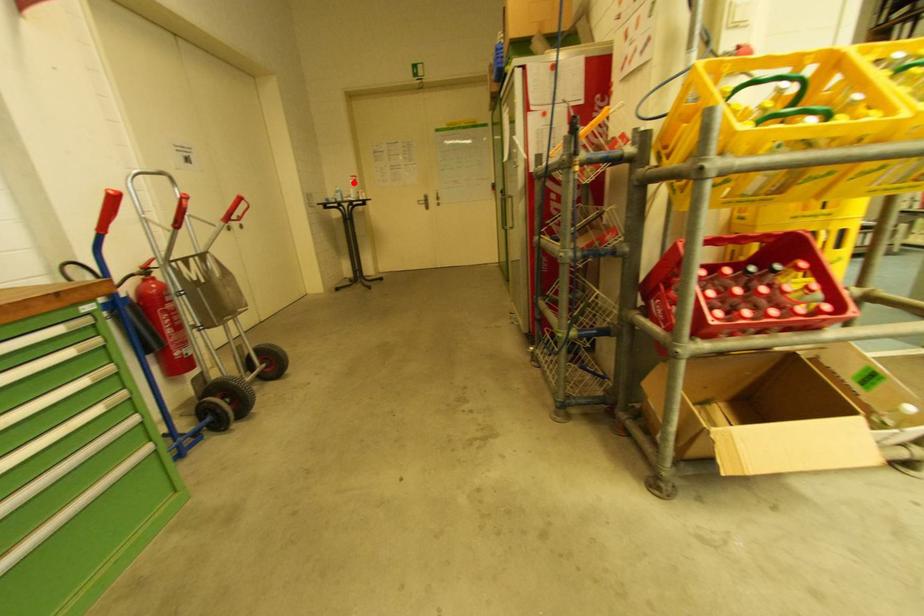
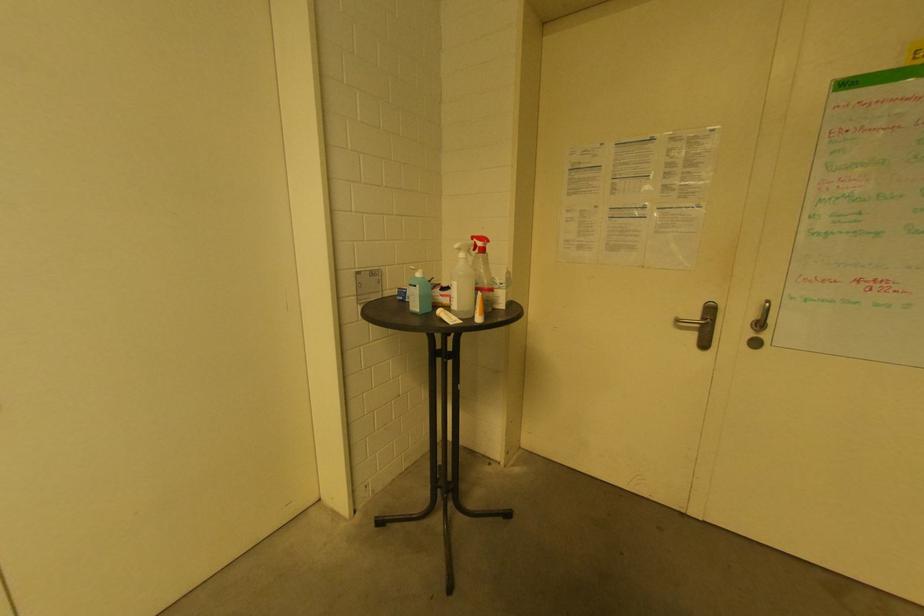
Question: I am providing you with two images of the same scene from different viewpoints. Image1 has a red point marked. In image2, the corresponding 3D location appears at what relative position? Reply with the corresponding letter.

Choices:
 (A) Closer
 (B) Farther

Answer: (B)